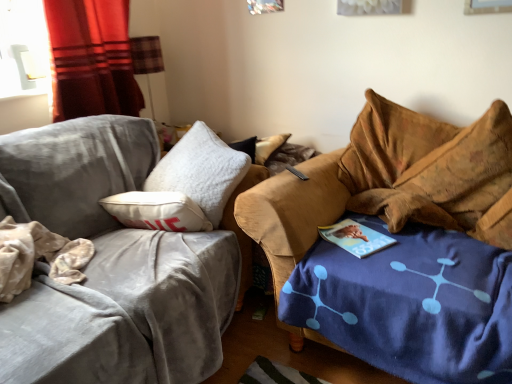
Question: From a real-world perspective, is velvet brown couch at right, which is counted as the 2th studio couch, starting from the left, physically below plaid fabric lampshade at upper left?

Choices:
 (A) yes
 (B) no

Answer: (A)

Question: Is velvet brown couch at right, the first studio couch in the right-to-left sequence, shorter than plaid fabric lampshade at upper left?

Choices:
 (A) no
 (B) yes

Answer: (A)

Question: Is velvet brown couch at right, which is counted as the 2th studio couch, starting from the left, outside plaid fabric lampshade at upper left?

Choices:
 (A) no
 (B) yes

Answer: (B)

Question: From the image's perspective, is velvet brown couch at right, which is counted as the 2th studio couch, starting from the left, on plaid fabric lampshade at upper left?

Choices:
 (A) no
 (B) yes

Answer: (A)

Question: Does velvet brown couch at right, the first studio couch in the right-to-left sequence, come behind plaid fabric lampshade at upper left?

Choices:
 (A) no
 (B) yes

Answer: (A)

Question: Is point (128, 182) closer or farther from the camera than point (404, 180)?

Choices:
 (A) farther
 (B) closer

Answer: (A)

Question: Considering the relative positions of velvet gray couch at left, the 1th studio couch when ordered from left to right, and velvet brown couch at right, the first studio couch in the right-to-left sequence, in the image provided, is velvet gray couch at left, the 1th studio couch when ordered from left to right, to the left or to the right of velvet brown couch at right, the first studio couch in the right-to-left sequence,?

Choices:
 (A) right
 (B) left

Answer: (B)

Question: Based on their sizes in the image, would you say velvet gray couch at left, the 1th studio couch when ordered from left to right, is bigger or smaller than velvet brown couch at right, which is counted as the 2th studio couch, starting from the left?

Choices:
 (A) big
 (B) small

Answer: (A)

Question: Considering the positions of velvet gray couch at left, which is the second studio couch in right-to-left order, and velvet brown couch at right, which is counted as the 2th studio couch, starting from the left, in the image, is velvet gray couch at left, which is the second studio couch in right-to-left order, taller or shorter than velvet brown couch at right, which is counted as the 2th studio couch, starting from the left,?

Choices:
 (A) tall
 (B) short

Answer: (A)

Question: Is velvet brown couch at right, which is counted as the 2th studio couch, starting from the left, taller or shorter than velvet gray couch at left, which is the second studio couch in right-to-left order?

Choices:
 (A) short
 (B) tall

Answer: (A)

Question: From the image's perspective, is velvet brown couch at right, the first studio couch in the right-to-left sequence, above or below velvet gray couch at left, the 1th studio couch when ordered from left to right?

Choices:
 (A) above
 (B) below

Answer: (B)

Question: Relative to velvet gray couch at left, the 1th studio couch when ordered from left to right, is velvet brown couch at right, which is counted as the 2th studio couch, starting from the left, in front or behind?

Choices:
 (A) behind
 (B) front

Answer: (A)

Question: From a real-world perspective, relative to velvet gray couch at left, which is the second studio couch in right-to-left order, is velvet brown couch at right, the first studio couch in the right-to-left sequence, vertically above or below?

Choices:
 (A) above
 (B) below

Answer: (B)

Question: Is brown velvety bean bag chair at right wider or thinner than plaid fabric lampshade at upper left?

Choices:
 (A) wide
 (B) thin

Answer: (A)

Question: From a real-world perspective, is brown velvety bean bag chair at right physically located above or below plaid fabric lampshade at upper left?

Choices:
 (A) above
 (B) below

Answer: (B)